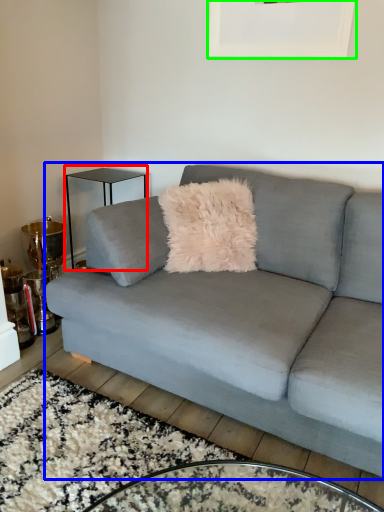
Question: Which is nearer to the table (highlighted by a red box)? studio couch (highlighted by a blue box) or picture frame (highlighted by a green box).

Choices:
 (A) studio couch
 (B) picture frame

Answer: (B)